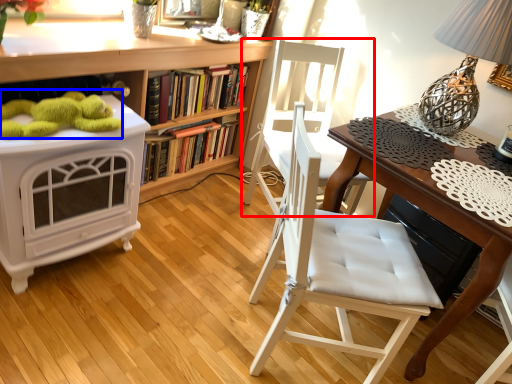
Question: Which object is closer to the camera taking this photo, chair (highlighted by a red box) or toy (highlighted by a blue box)?

Choices:
 (A) chair
 (B) toy

Answer: (B)